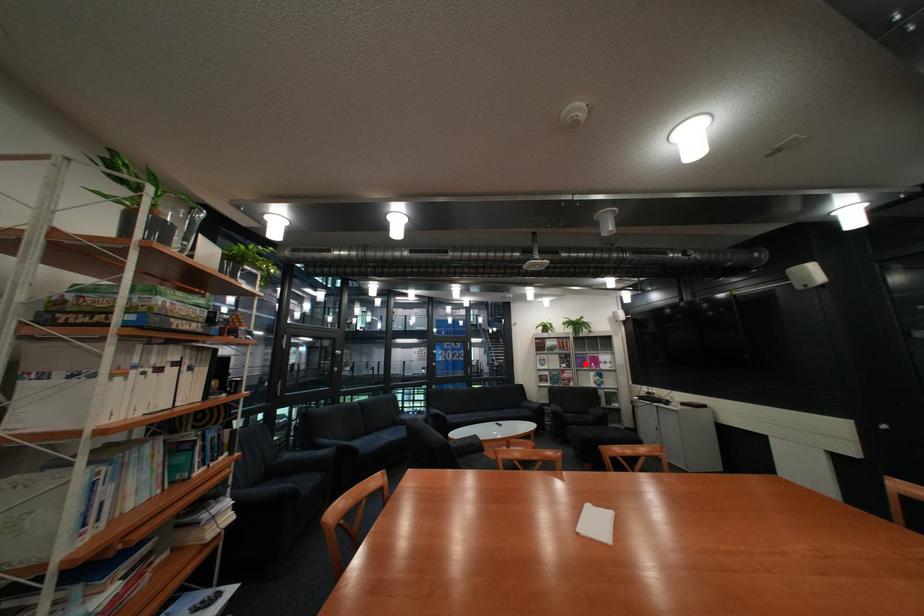
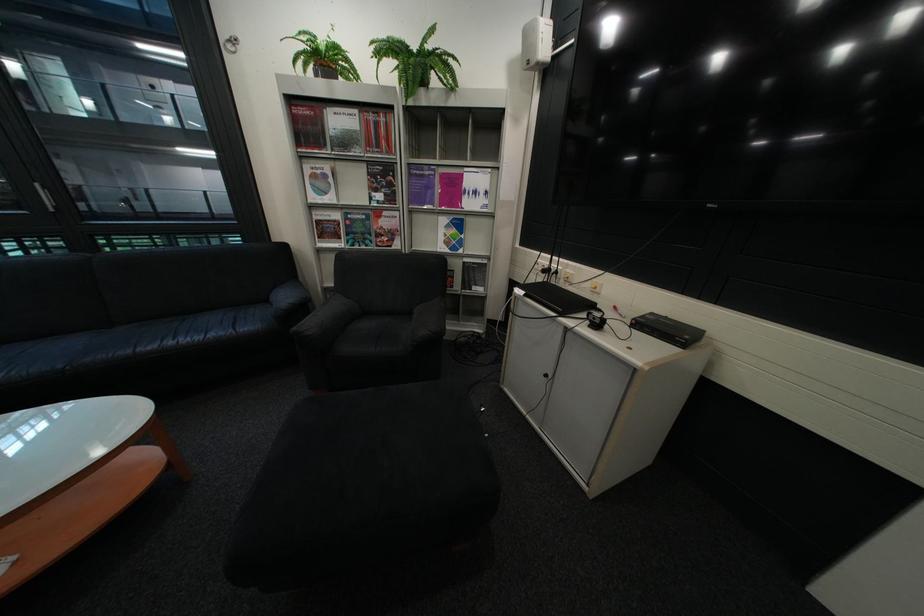
Question: I am providing you with two images of the same scene from different viewpoints. A red point is marked on the first image. Is the red point's position out of view in image 2?

Choices:
 (A) Yes
 (B) No

Answer: (B)